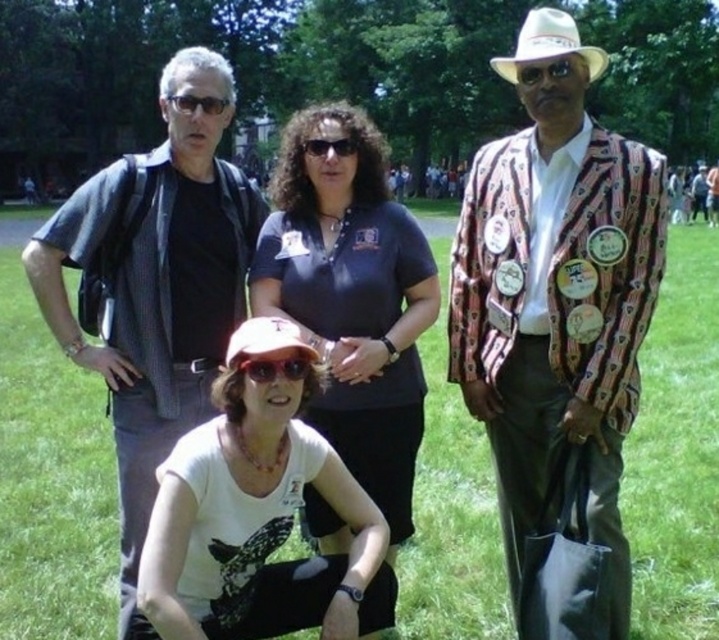
You are standing in the park and see the point at coordinates (201, 138). If you walk straight ahead, will you reach that point before walking 15 feet?

Yes, because the point at coordinates (201, 138) is only 12.73 feet away from you, which is less than 15 feet.

What are the coordinates of the matte black shirt at left?

The coordinates of the matte black shirt at left are at point [157,289].